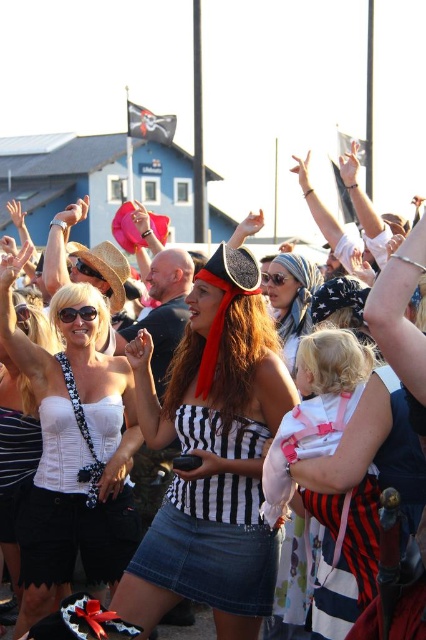
You are a photographer trying to capture the woman in the center. You notice the white matte corset at center and the black plastic goggles at center. Which item is positioned in front of the other?

The white matte corset at center is closer to the viewer than the black plastic goggles at center, so the corset is in front of the goggles.

You are a costume designer preparing for a pirate play. You have two items from the image to place on a mannequin. The white matte corset at center and the black plastic goggles at center. Which item will require more horizontal space on the mannequin?

The white matte corset at center requires more horizontal space on the mannequin because its width is larger than the black plastic goggles at center.